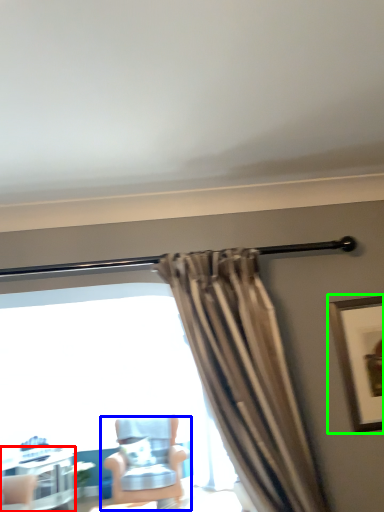
Question: Based on their relative distances, which object is nearer to table (highlighted by a red box)? Choose from chair (highlighted by a blue box) and picture frame (highlighted by a green box).

Choices:
 (A) chair
 (B) picture frame

Answer: (A)